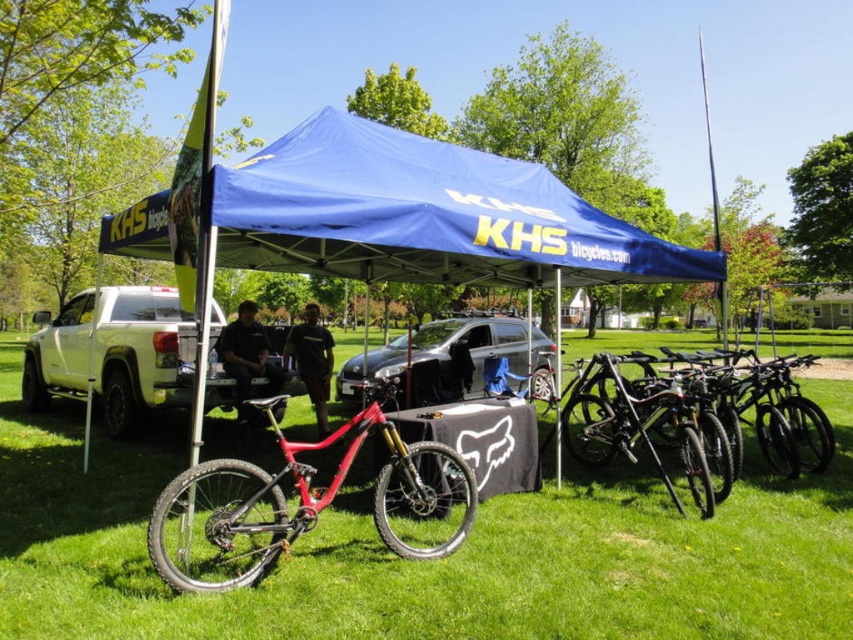
Between blue fabric canopy at center and shiny black bike at right, which one is positioned lower?

shiny black bike at right

Is point (407, 173) in front of point (825, 448)?

Yes.

Is point (349, 122) farther from camera compared to point (688, 416)?

Yes, it is.

The height and width of the screenshot is (640, 853). Identify the location of blue fabric canopy at center. (425, 216).

Who is more distant from viewer, (248, 486) or (639, 417)?

Point (639, 417)

Who is more forward, (x=306, y=506) or (x=625, y=356)?

Point (x=306, y=506)

Describe the element at coordinates (300, 500) in the screenshot. I see `shiny red bike at center` at that location.

At what (x,y) coordinates should I click in order to perform the action: click on shiny red bike at center. Please return your answer as a coordinate pair (x, y). This screenshot has width=853, height=640. Looking at the image, I should click on (300, 500).

Between green grass at center and shiny black bike at right, which one appears on the right side from the viewer's perspective?

From the viewer's perspective, shiny black bike at right appears more on the right side.

The image size is (853, 640). Describe the element at coordinates (433, 561) in the screenshot. I see `green grass at center` at that location.

This screenshot has height=640, width=853. What do you see at coordinates (433, 561) in the screenshot? I see `green grass at center` at bounding box center [433, 561].

Identify the location of green grass at center. (433, 561).